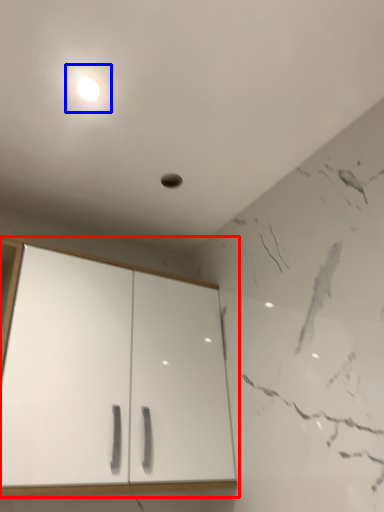
Question: Which object appears farthest to the camera in this image, cupboard (highlighted by a red box) or light (highlighted by a blue box)?

Choices:
 (A) cupboard
 (B) light

Answer: (B)